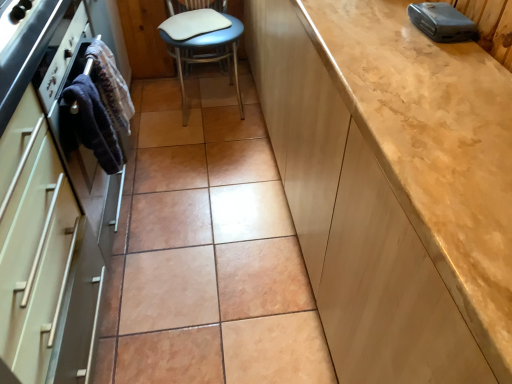
Question: Is matte white oven at left, the second cabinetry viewed from the right, surrounding white leather chair at center?

Choices:
 (A) no
 (B) yes

Answer: (A)

Question: From a real-world perspective, is matte white oven at left, which ranks as the 1th cabinetry in left-to-right order, on white leather chair at center?

Choices:
 (A) yes
 (B) no

Answer: (A)

Question: Considering the relative sizes of matte white oven at left, the second cabinetry viewed from the right, and white leather chair at center in the image provided, is matte white oven at left, the second cabinetry viewed from the right, smaller than white leather chair at center?

Choices:
 (A) yes
 (B) no

Answer: (A)

Question: Is matte white oven at left, which ranks as the 1th cabinetry in left-to-right order, oriented towards white leather chair at center?

Choices:
 (A) no
 (B) yes

Answer: (A)

Question: Can you confirm if matte white oven at left, the second cabinetry viewed from the right, is bigger than white leather chair at center?

Choices:
 (A) yes
 (B) no

Answer: (B)

Question: From a real-world perspective, is dark blue fabric towel at left, the 2th material positioned from the back, positioned above or below dark blue fabric at left, arranged as the 1th material when viewed from the back?

Choices:
 (A) below
 (B) above

Answer: (B)

Question: From their relative heights in the image, would you say dark blue fabric towel at left, the 1th material when ordered from front to back, is taller or shorter than dark blue fabric at left, arranged as the 1th material when viewed from the back?

Choices:
 (A) tall
 (B) short

Answer: (B)

Question: Relative to dark blue fabric at left, marked as the 2th material in a front-to-back arrangement, is dark blue fabric towel at left, the 1th material when ordered from front to back, in front or behind?

Choices:
 (A) front
 (B) behind

Answer: (A)

Question: Considering the positions of dark blue fabric towel at left, the 1th material when ordered from front to back, and dark blue fabric at left, marked as the 2th material in a front-to-back arrangement, in the image, is dark blue fabric towel at left, the 1th material when ordered from front to back, wider or thinner than dark blue fabric at left, marked as the 2th material in a front-to-back arrangement,?

Choices:
 (A) thin
 (B) wide

Answer: (B)

Question: Considering their positions, is matte white oven at left, which ranks as the 1th cabinetry in left-to-right order, located in front of or behind dark blue fabric towel at left, the 1th material when ordered from front to back?

Choices:
 (A) front
 (B) behind

Answer: (A)

Question: Considering the positions of matte white oven at left, which ranks as the 1th cabinetry in left-to-right order, and dark blue fabric towel at left, the 2th material positioned from the back, in the image, is matte white oven at left, which ranks as the 1th cabinetry in left-to-right order, taller or shorter than dark blue fabric towel at left, the 2th material positioned from the back,?

Choices:
 (A) short
 (B) tall

Answer: (B)

Question: Looking at the image, does matte white oven at left, which ranks as the 1th cabinetry in left-to-right order, seem bigger or smaller compared to dark blue fabric towel at left, the 1th material when ordered from front to back?

Choices:
 (A) small
 (B) big

Answer: (B)

Question: Would you say matte white oven at left, the second cabinetry viewed from the right, is inside or outside dark blue fabric towel at left, the 1th material when ordered from front to back?

Choices:
 (A) outside
 (B) inside

Answer: (A)

Question: From a real-world perspective, relative to white leather chair at center, is matte beige cabinet at right, marked as the 2th cabinetry in a left-to-right arrangement, vertically above or below?

Choices:
 (A) below
 (B) above

Answer: (B)

Question: Based on their sizes in the image, would you say matte beige cabinet at right, marked as the first cabinetry in a right-to-left arrangement, is bigger or smaller than white leather chair at center?

Choices:
 (A) big
 (B) small

Answer: (A)